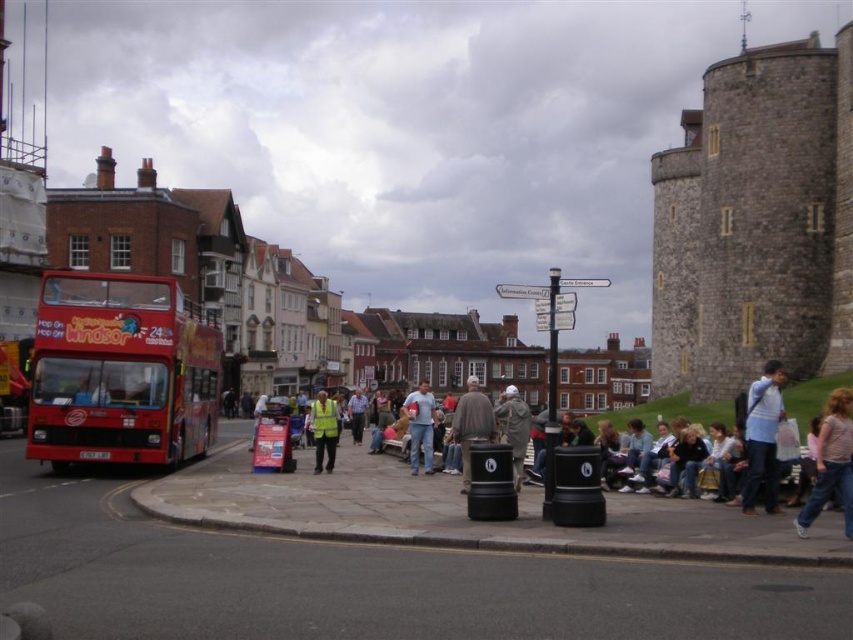
You are standing at the camera position and want to estimate how far the blue fabric jacket at lower right is from you. Can you determine the approximate distance?

The blue fabric jacket at lower right is approximately 42.38 meters away from the camera.

You are a tour guide standing at the red double decker bus with Windsor written on its front. You need to walk to the gray woolen hat at center and then to the blue fabric jacket at lower right. What is the total distance you will walk?

The total distance you will walk is 41.46 meters because the distance between blue fabric jacket at lower right and gray woolen hat at center is 20.73 meters, so going from the bus to the hat and then to the jacket would be 20.73 meters each way, totaling 41.46 meters.

You are a photographer standing on the street and want to take a photo of the pink fabric shirt at lower right and the gray woolen hat at center. Which object should you focus on first if you want to capture both in the same frame without moving the camera?

You should focus on the pink fabric shirt at lower right first because it is shorter than the gray woolen hat at center, so adjusting the focus to the closer object ensures both are in the frame.